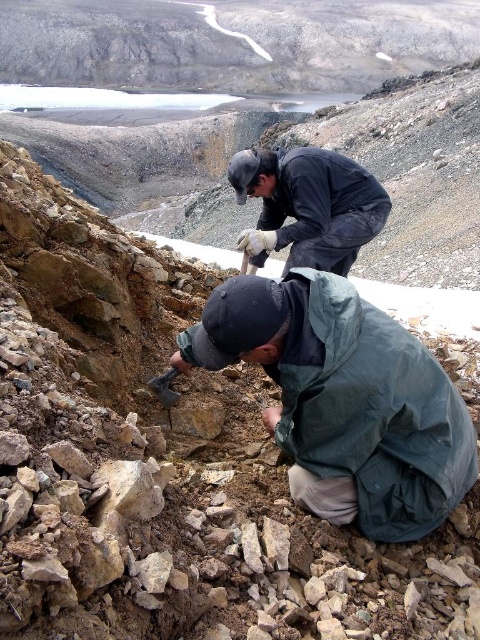
You are a hiker who has just arrived at this archaeological site. You need to locate the two researchers. Which direction should you look to find the green fabric jacket at lower right relative to the black matte jacket at upper center?

The green fabric jacket at lower right is to the right of the black matte jacket at upper center, so you should look to the right side of the black matte jacket at upper center to find it.

You are an archaeologist planning to move a heavy artifact from the green fabric jacket at lower right to the black matte jacket at upper center. Considering their positions, which direction should you move the artifact to ensure it reaches the correct location?

The green fabric jacket at lower right is not as tall as the black matte jacket at upper center, so you should move the artifact upward to reach the black matte jacket at upper center.

You are a drone operator tasked with capturing aerial footage of the excavation site. You need to ensure the camera captures both the point at coordinates point (452, 465) and point (376, 204). Given that the drone must maintain a safe distance from the workers, which point should the camera focus on first to ensure both points are in frame?

Point (452, 465) is closer to the viewer than point (376, 204). To ensure both points are in frame while maintaining a safe distance from the workers, the camera should focus on point (452, 465) first, as it is closer and will remain in view as the drone adjusts its position.